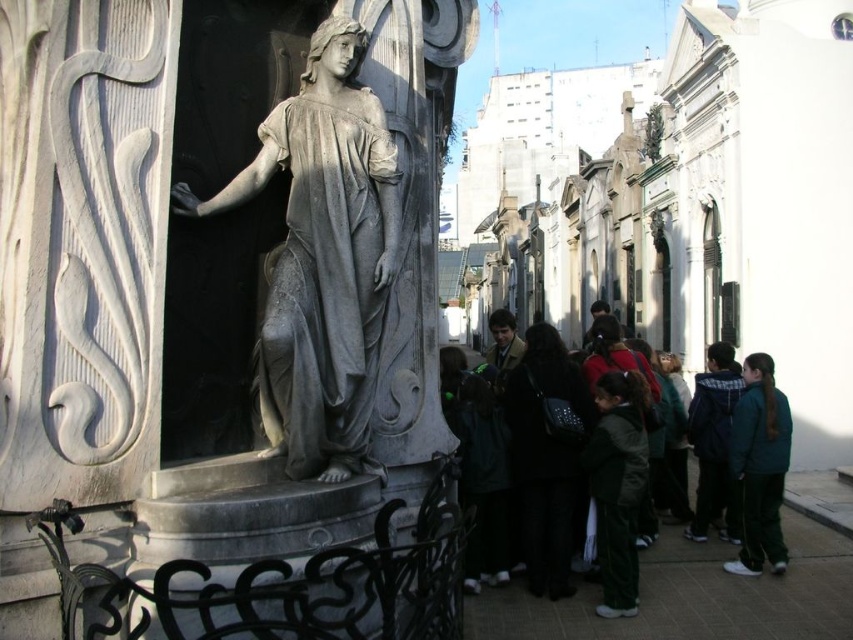
You are standing in front of the stone statue in the cemetery. You notice two jackets nearby. The green fabric jackets at lower right and the dark blue jacket at center. Which jacket is closer to you?

The green fabric jackets at lower right is closer to the viewer than the dark blue jacket at center.

You are a photographer setting up a tripod to capture the gray stone statue at center and the dark blue jacket at center. Since you want to ensure both subjects are in focus, you need to know which one is taller. Can you determine which object is taller?

The gray stone statue at center is taller than the dark blue jacket at center, so you should focus on the statue first to ensure both are in focus.